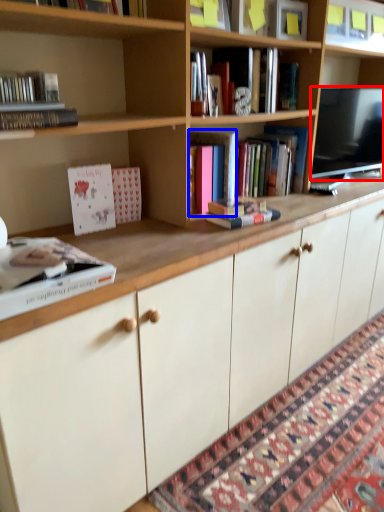
Question: Among these objects, which one is farthest to the camera, television (highlighted by a red box) or book (highlighted by a blue box)?

Choices:
 (A) television
 (B) book

Answer: (A)